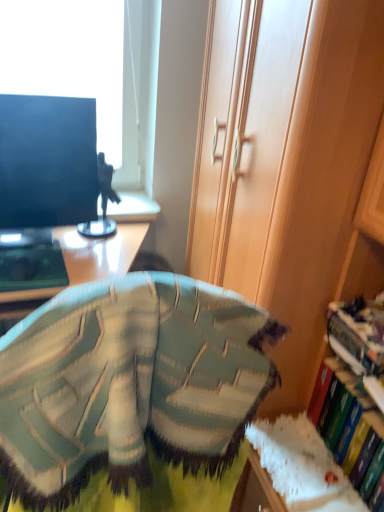
Question: Can you confirm if green knitted bean bag chair at center is smaller than hardcover book at right, the second book when ordered from top to bottom?

Choices:
 (A) yes
 (B) no

Answer: (B)

Question: Considering the relative sizes of green knitted bean bag chair at center and hardcover book at right, which is the 1th book in bottom-to-top order, in the image provided, is green knitted bean bag chair at center bigger than hardcover book at right, which is the 1th book in bottom-to-top order,?

Choices:
 (A) no
 (B) yes

Answer: (B)

Question: Is green knitted bean bag chair at center oriented towards hardcover book at right, the second book when ordered from top to bottom?

Choices:
 (A) yes
 (B) no

Answer: (B)

Question: Can you confirm if green knitted bean bag chair at center is thinner than hardcover book at right, the second book when ordered from top to bottom?

Choices:
 (A) yes
 (B) no

Answer: (B)

Question: Would you say green knitted bean bag chair at center contains hardcover book at right, which is the 1th book in bottom-to-top order?

Choices:
 (A) yes
 (B) no

Answer: (B)

Question: Is green knitted bean bag chair at center completely or partially outside of hardcover book at right, which is the 1th book in bottom-to-top order?

Choices:
 (A) no
 (B) yes

Answer: (B)

Question: Does wooden cabinet at right come in front of matte black monitor at left?

Choices:
 (A) yes
 (B) no

Answer: (A)

Question: Does wooden cabinet at right appear on the right side of matte black monitor at left?

Choices:
 (A) no
 (B) yes

Answer: (B)

Question: Is wooden cabinet at right aimed at matte black monitor at left?

Choices:
 (A) no
 (B) yes

Answer: (A)

Question: Can you confirm if wooden cabinet at right is positioned to the left of matte black monitor at left?

Choices:
 (A) yes
 (B) no

Answer: (B)

Question: Does wooden cabinet at right have a greater height compared to matte black monitor at left?

Choices:
 (A) no
 (B) yes

Answer: (B)

Question: Is wooden cabinet at right far from matte black monitor at left?

Choices:
 (A) no
 (B) yes

Answer: (A)

Question: Is hardcover book at right, which is the 1th book in bottom-to-top order, bigger than green knitted bean bag chair at center?

Choices:
 (A) no
 (B) yes

Answer: (A)